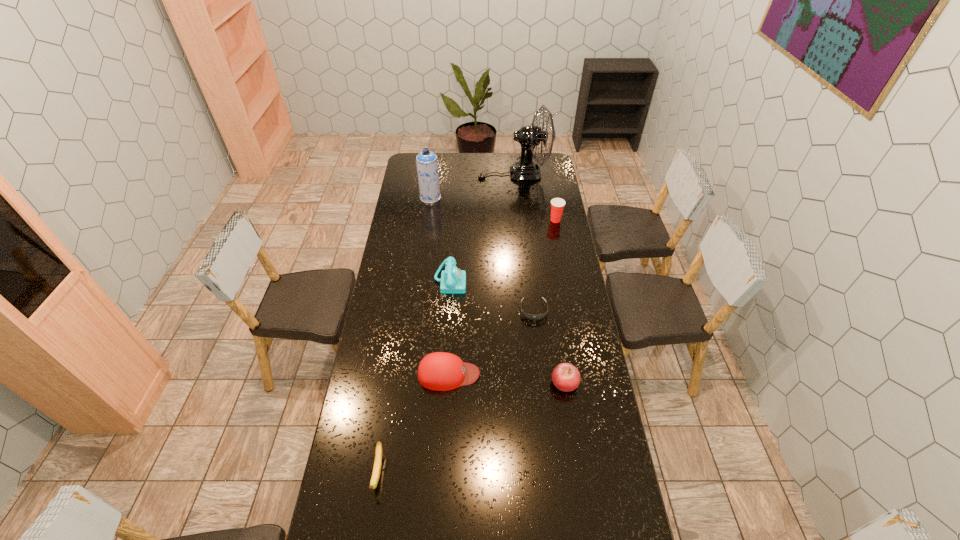
This screenshot has height=540, width=960. Find the location of `free space at the far edge of the desktop`. free space at the far edge of the desktop is located at coordinates (472, 166).

Where is `free point at the left edge`? free point at the left edge is located at coordinates (397, 209).

The image size is (960, 540). In the image, there is a desktop. What are the coordinates of `vacant space at the right edge` in the screenshot? It's located at (593, 434).

The height and width of the screenshot is (540, 960). In order to click on free space between the apple and the nearest object in this screenshot , I will do `click(471, 428)`.

The height and width of the screenshot is (540, 960). I want to click on free spot between the shortest object and the telephone, so click(492, 296).

Find the location of a particular element. The width and height of the screenshot is (960, 540). free spot between the aerosol can and the second shortest object is located at coordinates (404, 335).

Locate an element on the screen. This screenshot has height=540, width=960. vacant point located between the second shortest object and the apple is located at coordinates (471, 428).

This screenshot has height=540, width=960. Identify the location of free area in between the Dixie cup and the shortest object. (544, 265).

Locate an element on the screen. empty space that is in between the apple and the nearest object is located at coordinates (471, 428).

You are a GUI agent. You are given a task and a screenshot of the screen. Output one action in this format:
    pyautogui.click(x=<x>, y=<y>)
    Task: Click on the free spot between the Dixie cup and the farthest object
    
    Given the screenshot: What is the action you would take?
    pyautogui.click(x=535, y=197)